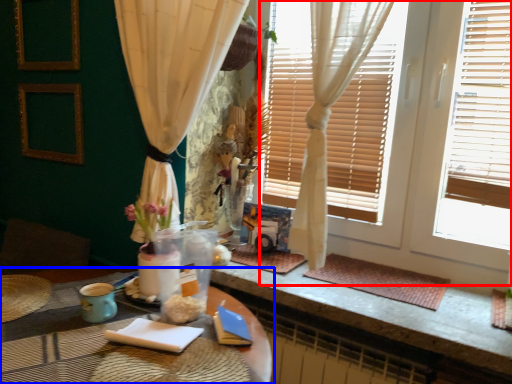
Question: Among these objects, which one is farthest to the camera, window frame (highlighted by a red box) or table (highlighted by a blue box)?

Choices:
 (A) window frame
 (B) table

Answer: (A)